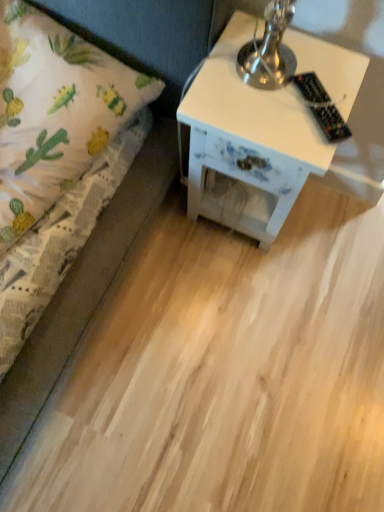
Question: Is white painted wood nightstand at right positioned behind white fabric bed at left?

Choices:
 (A) yes
 (B) no

Answer: (A)

Question: Does white painted wood nightstand at right have a greater height compared to white fabric bed at left?

Choices:
 (A) yes
 (B) no

Answer: (A)

Question: Does white painted wood nightstand at right contain white fabric bed at left?

Choices:
 (A) no
 (B) yes

Answer: (A)

Question: Considering the relative positions of white painted wood nightstand at right and white fabric bed at left in the image provided, is white painted wood nightstand at right to the left of white fabric bed at left from the viewer's perspective?

Choices:
 (A) no
 (B) yes

Answer: (A)

Question: Is white painted wood nightstand at right not near white fabric bed at left?

Choices:
 (A) no
 (B) yes

Answer: (A)

Question: Is white painted wood nightstand at right at the right side of white fabric bed at left?

Choices:
 (A) no
 (B) yes

Answer: (B)

Question: From the image's perspective, is white painted wood nightstand at right on black plastic remote control at upper right?

Choices:
 (A) no
 (B) yes

Answer: (A)

Question: Is white painted wood nightstand at right to the left of black plastic remote control at upper right from the viewer's perspective?

Choices:
 (A) no
 (B) yes

Answer: (B)

Question: Is white painted wood nightstand at right closer to the viewer compared to black plastic remote control at upper right?

Choices:
 (A) no
 (B) yes

Answer: (A)

Question: Is white painted wood nightstand at right smaller than black plastic remote control at upper right?

Choices:
 (A) no
 (B) yes

Answer: (A)

Question: Is white painted wood nightstand at right positioned far away from black plastic remote control at upper right?

Choices:
 (A) no
 (B) yes

Answer: (A)

Question: From a real-world perspective, is white painted wood nightstand at right positioned over black plastic remote control at upper right based on gravity?

Choices:
 (A) yes
 (B) no

Answer: (B)

Question: Can white painted wood nightstand at right be found inside black plastic remote control at upper right?

Choices:
 (A) no
 (B) yes

Answer: (A)